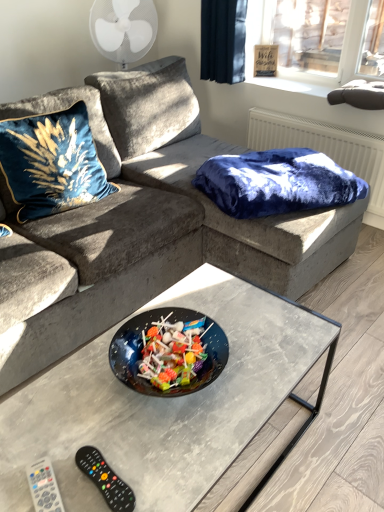
Question: From the image's perspective, is velvet fabric couch at center above velvet blue blanket at upper right?

Choices:
 (A) yes
 (B) no

Answer: (B)

Question: Is the depth of velvet fabric couch at center less than that of velvet blue blanket at upper right?

Choices:
 (A) yes
 (B) no

Answer: (A)

Question: Can we say velvet fabric couch at center lies outside velvet blue blanket at upper right?

Choices:
 (A) no
 (B) yes

Answer: (B)

Question: Does velvet fabric couch at center have a greater width compared to velvet blue blanket at upper right?

Choices:
 (A) yes
 (B) no

Answer: (A)

Question: From a real-world perspective, is velvet fabric couch at center over velvet blue blanket at upper right?

Choices:
 (A) no
 (B) yes

Answer: (A)

Question: From a real-world perspective, is velvet fabric couch at center beneath velvet blue blanket at upper right?

Choices:
 (A) no
 (B) yes

Answer: (B)

Question: Is velvet blue blanket at upper right a part of black plastic remote at lower left, marked as the first remote in a right-to-left arrangement?

Choices:
 (A) no
 (B) yes

Answer: (A)

Question: Can we say black plastic remote at lower left, marked as the first remote in a right-to-left arrangement, lies outside velvet blue blanket at upper right?

Choices:
 (A) no
 (B) yes

Answer: (B)

Question: Is black plastic remote at lower left, marked as the first remote in a right-to-left arrangement, taller than velvet blue blanket at upper right?

Choices:
 (A) yes
 (B) no

Answer: (B)

Question: Is black plastic remote at lower left, marked as the first remote in a right-to-left arrangement, bigger than velvet blue blanket at upper right?

Choices:
 (A) yes
 (B) no

Answer: (B)

Question: Would you consider black plastic remote at lower left, which ranks as the 2th remote in left-to-right order, to be distant from velvet blue blanket at upper right?

Choices:
 (A) no
 (B) yes

Answer: (B)

Question: From a real-world perspective, is black plastic remote at lower left, which ranks as the 2th remote in left-to-right order, positioned over velvet blue blanket at upper right based on gravity?

Choices:
 (A) yes
 (B) no

Answer: (B)

Question: Could you tell me if velvet blue blanket at upper right is facing velvet blue pillow at upper left?

Choices:
 (A) yes
 (B) no

Answer: (B)